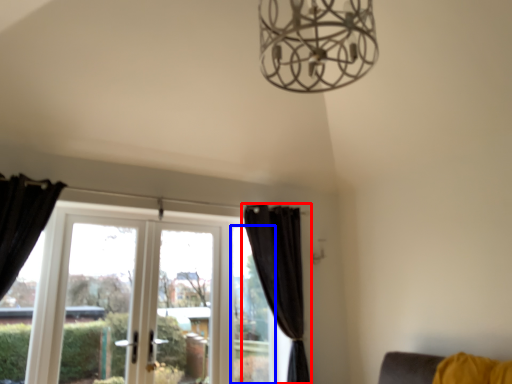
Question: Which point is closer to the camera, curtain (highlighted by a red box) or window (highlighted by a blue box)?

Choices:
 (A) curtain
 (B) window

Answer: (A)